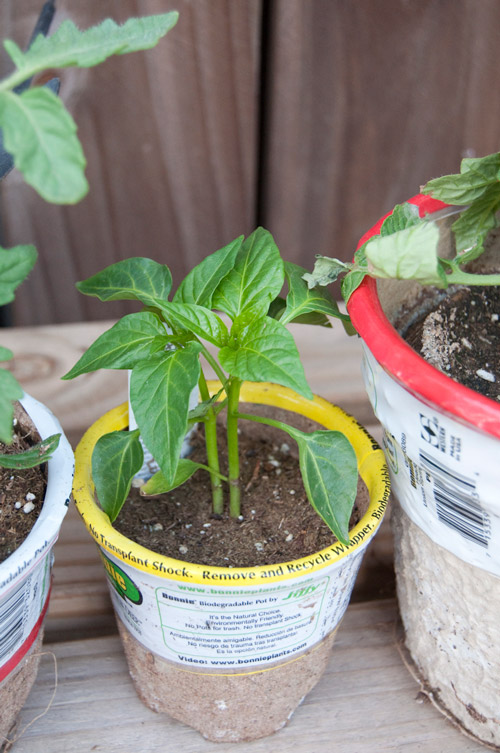
The width and height of the screenshot is (500, 753). In order to click on cracks at bottom of right planter in this screenshot , I will do `click(441, 700)`, `click(461, 697)`.